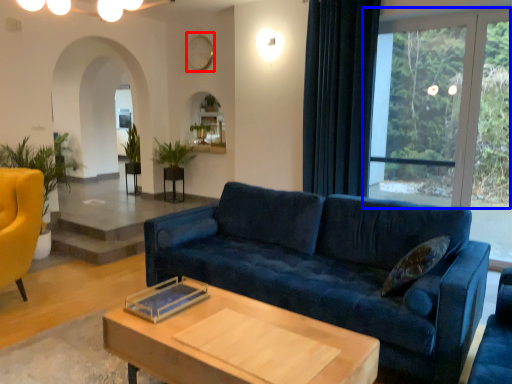
Question: Which object is closer to the camera taking this photo, clock (highlighted by a red box) or window (highlighted by a blue box)?

Choices:
 (A) clock
 (B) window

Answer: (B)